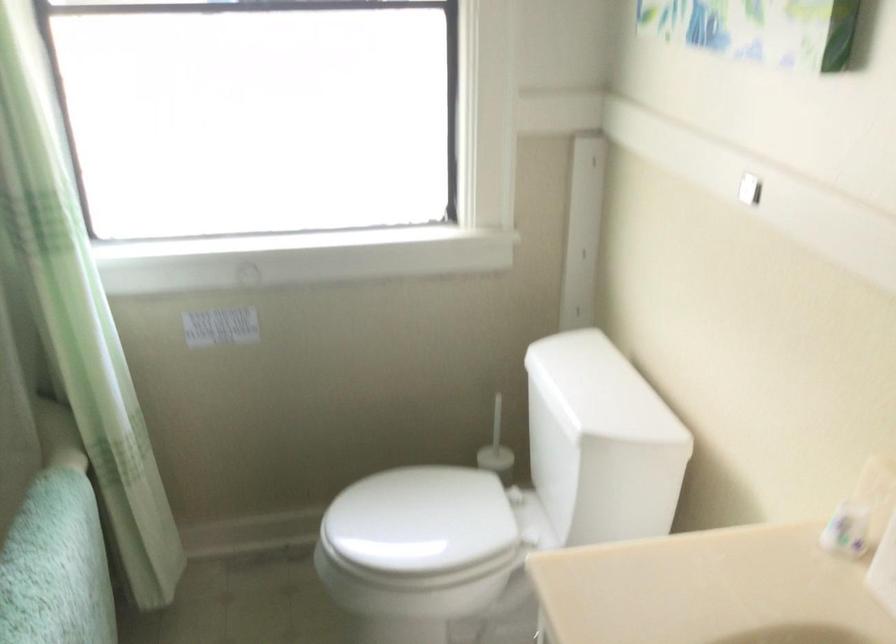
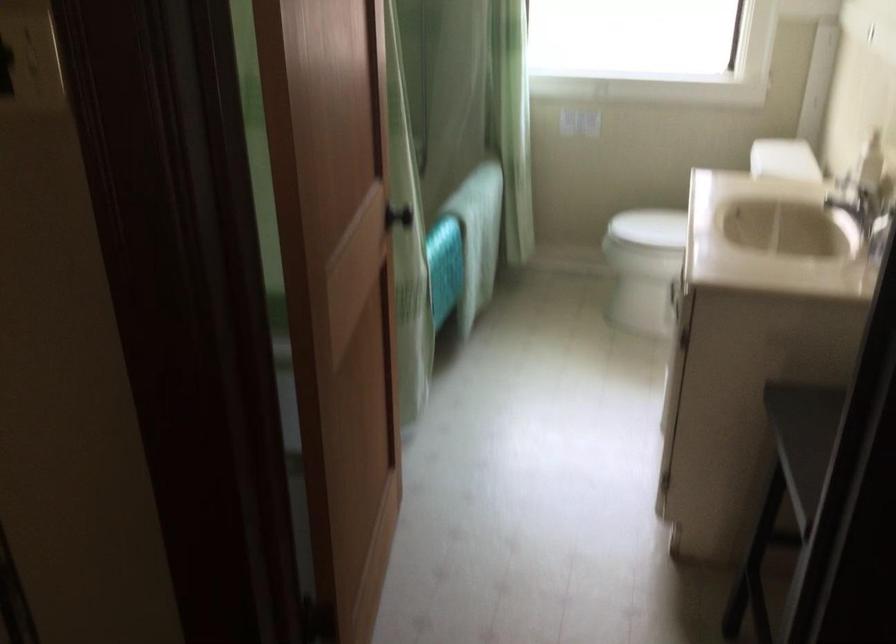
Find the pixel in the second image that matches (x=617, y=410) in the first image.

(784, 158)